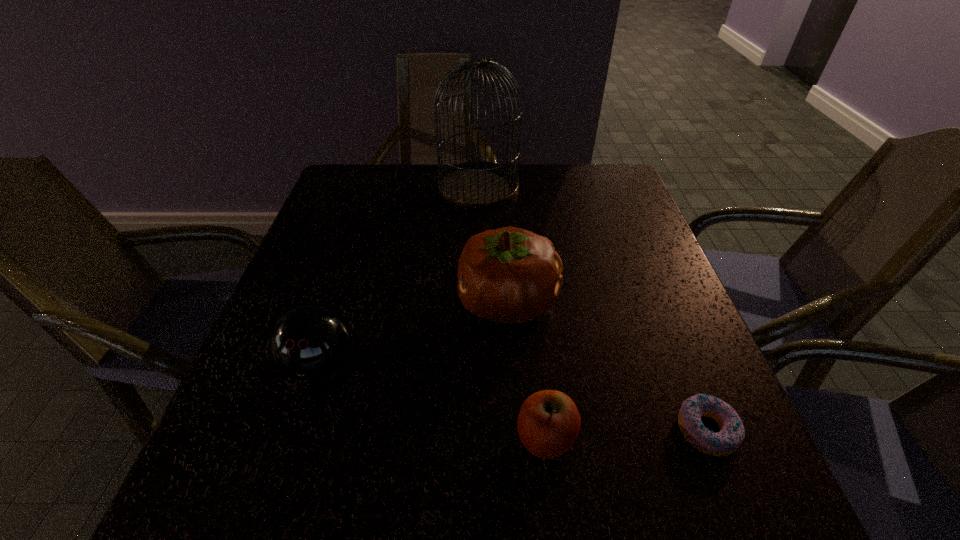
The image size is (960, 540). In order to click on free spot between the second shortest object and the doughnut in this screenshot , I will do `click(627, 434)`.

This screenshot has width=960, height=540. Find the location of `free space between the bowling ball and the fourth tallest object`. free space between the bowling ball and the fourth tallest object is located at coordinates 433,401.

I want to click on object identified as the second closest to the fourth shortest object, so click(309, 342).

Where is `object that is the closest to the doughnut`? This screenshot has width=960, height=540. object that is the closest to the doughnut is located at coordinates (548, 424).

Where is `vacant space that satisfies the following two spatial constraints: 1. on the side of the second shortest object with the cute face; 2. on the right side of the pumpkin`? The height and width of the screenshot is (540, 960). vacant space that satisfies the following two spatial constraints: 1. on the side of the second shortest object with the cute face; 2. on the right side of the pumpkin is located at coordinates (516, 438).

The width and height of the screenshot is (960, 540). What are the coordinates of `vacant space that satisfies the following two spatial constraints: 1. on the surface of the leftmost object near the finger holes; 2. on the right side of the second shortest object` in the screenshot? It's located at (298, 438).

Identify the location of vacant space that satisfies the following two spatial constraints: 1. on the back side of the apple; 2. on the side of the pumpkin with the cute face. Image resolution: width=960 pixels, height=540 pixels. (530, 301).

Where is `vacant space that satisfies the following two spatial constraints: 1. on the side of the pumpkin with the cute face; 2. on the surface of the leftmost object near the finger holes`? vacant space that satisfies the following two spatial constraints: 1. on the side of the pumpkin with the cute face; 2. on the surface of the leftmost object near the finger holes is located at coordinates (512, 364).

I want to click on free point that satisfies the following two spatial constraints: 1. on the side of the rightmost object with the cute face; 2. on the left side of the second tallest object, so click(x=516, y=430).

Where is `free space that satisfies the following two spatial constraints: 1. on the surface of the bowling ball near the finger holes; 2. on the left side of the fourth tallest object`? Image resolution: width=960 pixels, height=540 pixels. free space that satisfies the following two spatial constraints: 1. on the surface of the bowling ball near the finger holes; 2. on the left side of the fourth tallest object is located at coordinates (298, 438).